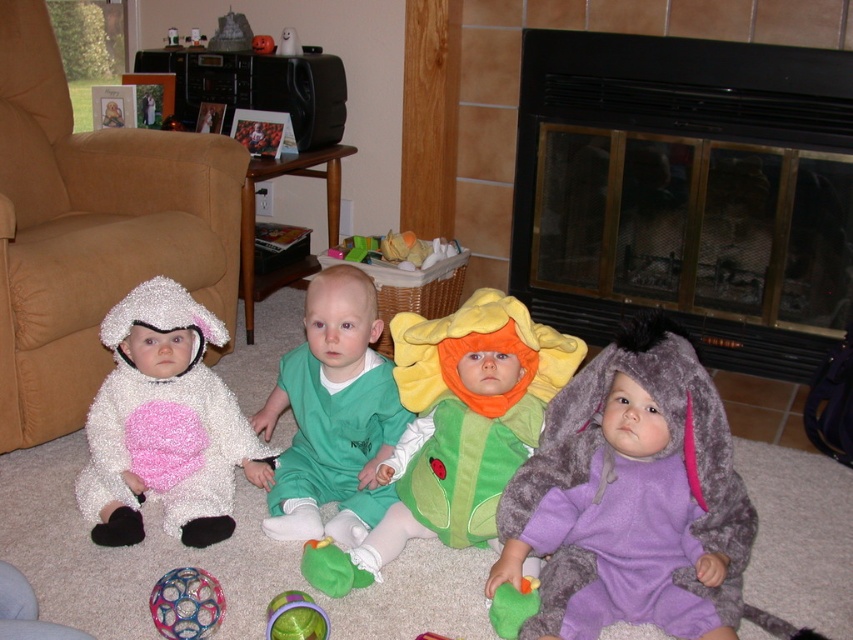
You are a parent trying to retrieve a toy for your child. In the scene, there are a green fabric onesie at center and a translucent plastic ball at center. Which object is positioned to the right side?

The green fabric onesie at center is positioned to the right of the translucent plastic ball at center.

You are a parent trying to place a small toy on the floor between the black glass fireplace at center and the green fuzzy toy at lower right. Considering their sizes, which object should you place the toy closer to to ensure it doesn

The black glass fireplace at center is bigger than the green fuzzy toy at lower right, so placing the toy closer to the smaller green fuzzy toy at lower right would leave more space around the larger fireplace.

You are standing in the room and want to light the black glass fireplace at center. If you are 1.6 meters tall, can you reach the fireplace?

The distance between you and the black glass fireplace at center is 2.41 meters. Since the fireplace is at center and you are 1.6 meters tall, you would need to move closer to reach it, as the current distance is greater than your height.